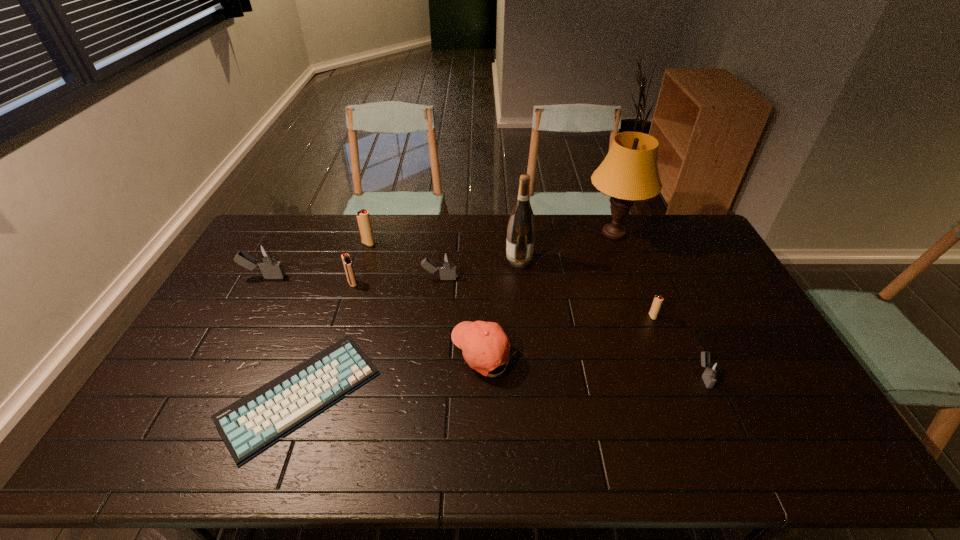
Image resolution: width=960 pixels, height=540 pixels. In order to click on object located at the near edge in this screenshot , I will do `click(249, 425)`.

This screenshot has height=540, width=960. Find the location of `object that is at the left edge`. object that is at the left edge is located at coordinates (266, 258).

Image resolution: width=960 pixels, height=540 pixels. Find the location of `vacant space at the far edge`. vacant space at the far edge is located at coordinates (501, 244).

The height and width of the screenshot is (540, 960). What are the coordinates of `vacant space at the near edge of the desktop` in the screenshot? It's located at (649, 464).

I want to click on vacant space at the left edge of the desktop, so click(x=228, y=324).

In the image, there is a desktop. Identify the location of vacant space at the right edge. (783, 411).

What are the coordinates of `blank space at the far left corner of the desktop` in the screenshot? It's located at (270, 219).

This screenshot has width=960, height=540. Find the location of `vacant area at the far right corner`. vacant area at the far right corner is located at coordinates (656, 222).

Locate an element on the screen. The height and width of the screenshot is (540, 960). vacant space in between the fourth igniter from left to right and the second nearest red igniter is located at coordinates (396, 281).

You are a GUI agent. You are given a task and a screenshot of the screen. Output one action in this format:
    pyautogui.click(x=<x>, y=<y>)
    Task: Click on the vacant space that's between the nearest igniter and the second biggest gray igniter
    The image size is (960, 540).
    Given the screenshot: What is the action you would take?
    pyautogui.click(x=571, y=327)